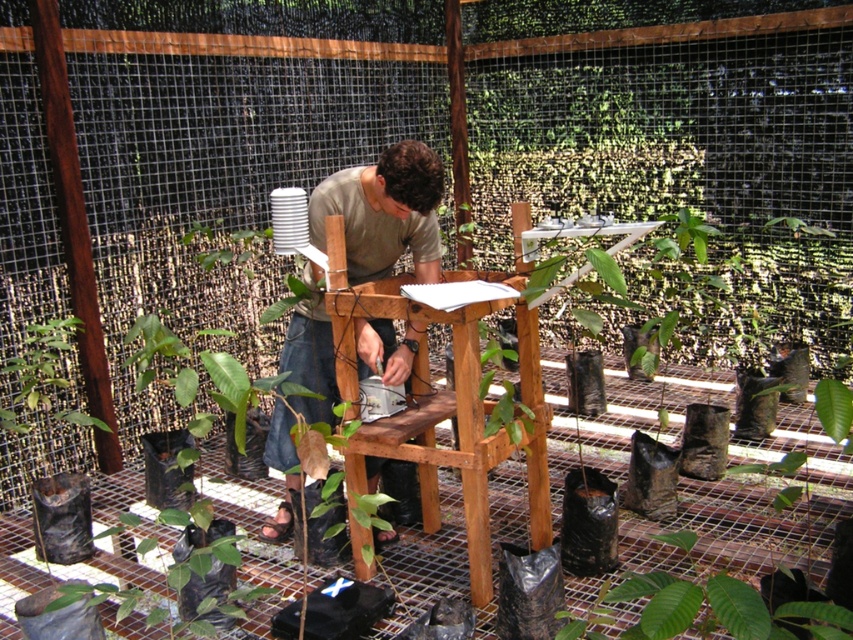
Question: Which of the following is the closest to the observer?

Choices:
 (A) (688, 602)
 (B) (335, 182)

Answer: (A)

Question: Is light brown wood man at center positioned in front of green matte plant at lower right?

Choices:
 (A) no
 (B) yes

Answer: (A)

Question: Is light brown wood man at center to the right of green matte plant at lower right from the viewer's perspective?

Choices:
 (A) no
 (B) yes

Answer: (A)

Question: Can you confirm if light brown wood man at center is positioned to the right of green matte plant at lower right?

Choices:
 (A) no
 (B) yes

Answer: (A)

Question: Which of the following is the farthest from the observer?

Choices:
 (A) (431, 186)
 (B) (613, 596)

Answer: (A)

Question: Which point is farther from the camera taking this photo?

Choices:
 (A) (711, 609)
 (B) (395, 536)

Answer: (B)